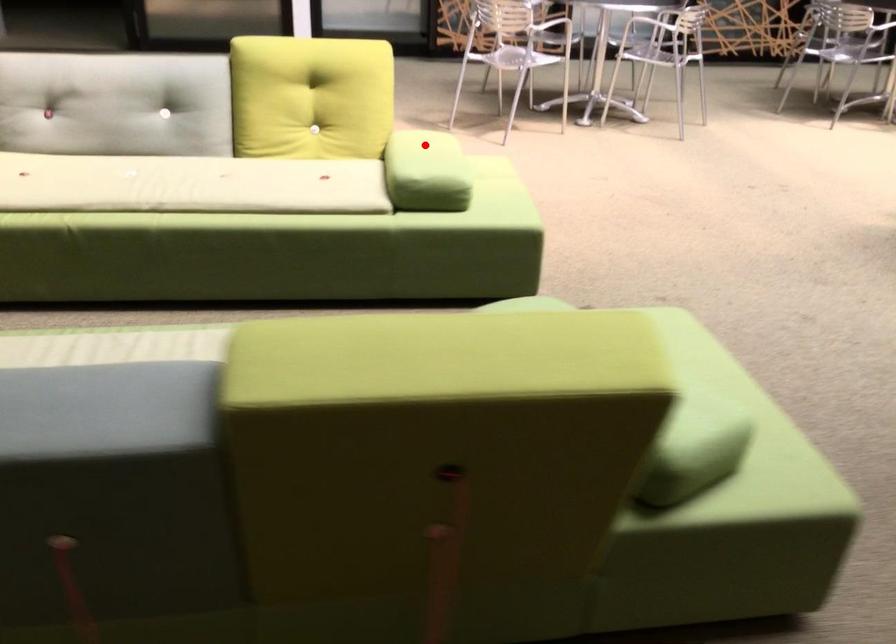
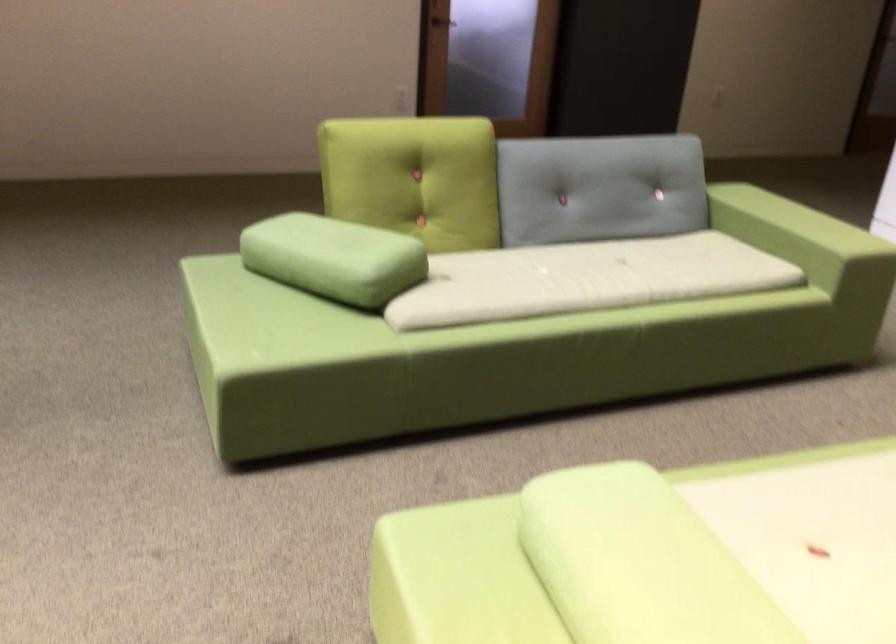
Where in the second image is the point corresponding to the highlighted location from the first image?

(651, 556)